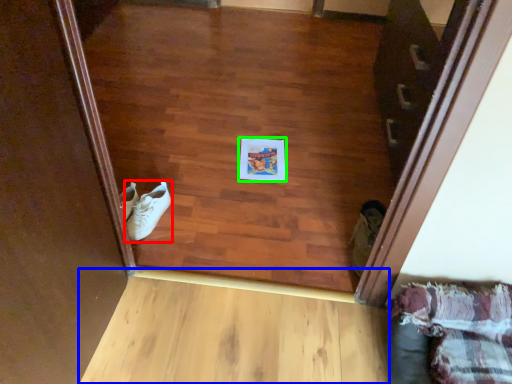
Question: Estimate the real-world distances between objects in this image. Which object is closer to footwear (highlighted by a red box), plank (highlighted by a blue box) or copy (highlighted by a green box)?

Choices:
 (A) plank
 (B) copy

Answer: (B)